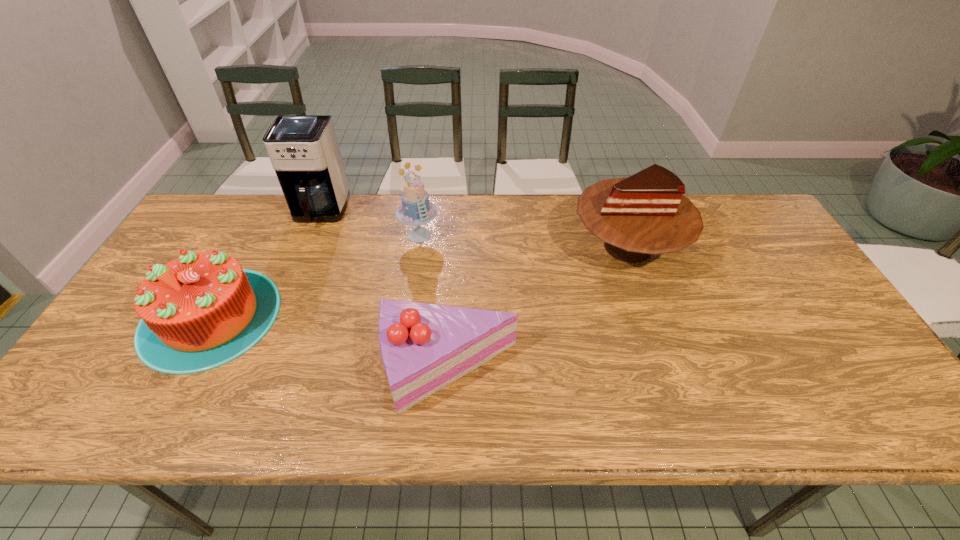
This screenshot has height=540, width=960. I want to click on coffee maker, so click(x=303, y=149).

Where is `the rightmost object`? The width and height of the screenshot is (960, 540). the rightmost object is located at coordinates (646, 214).

Where is `the leftmost cake`? the leftmost cake is located at coordinates (202, 310).

In order to click on the shortest object in this screenshot , I will do `click(424, 347)`.

At what (x,y) coordinates should I click in order to perform the action: click on blank space located on the front panel of the coffee maker. Please return your answer as a coordinate pair (x, y). Image resolution: width=960 pixels, height=540 pixels. Looking at the image, I should click on (286, 296).

Identify the location of blank space located on the front of the rightmost object. (664, 354).

Identify the location of vacant space located 0.120m on the right of the leftmost cake. This screenshot has height=540, width=960. tap(324, 316).

You are a GUI agent. You are given a task and a screenshot of the screen. Output one action in this format:
    pyautogui.click(x=<x>, y=<y>)
    Task: Click on the blank space located 0.280m on the back of the shortest cake
    
    Given the screenshot: What is the action you would take?
    pyautogui.click(x=455, y=253)

Find the location of a particular element. This screenshot has width=960, height=540. coffee maker present at the far edge is located at coordinates (303, 149).

Identify the location of object that is at the near edge. (424, 347).